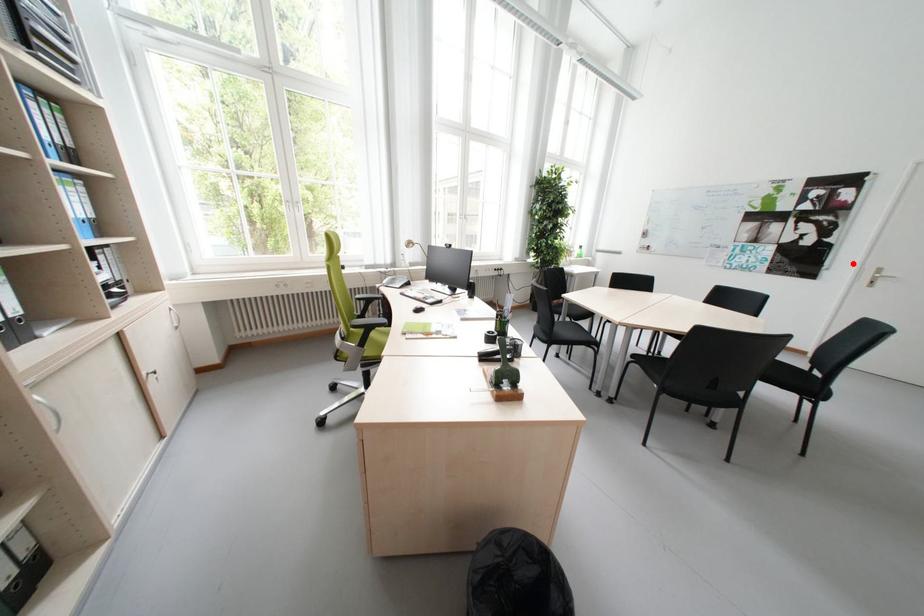
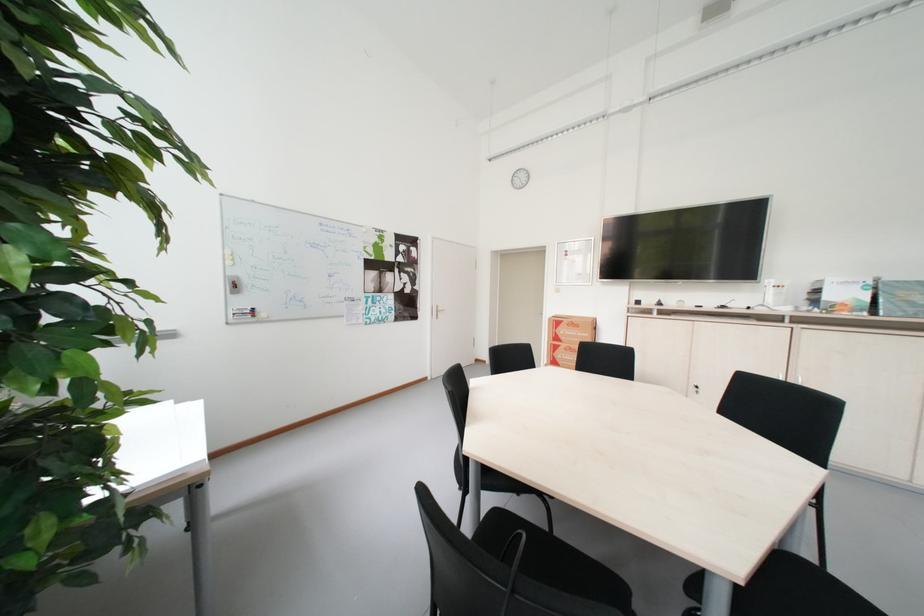
Find the pixel in the second image that matches the highlighted location in the first image.

(434, 305)